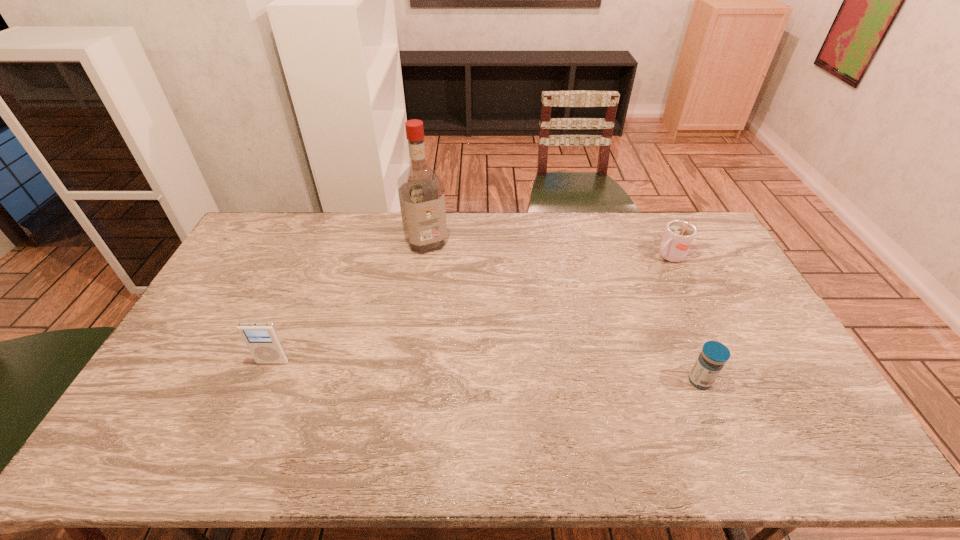
The width and height of the screenshot is (960, 540). Find the location of `the leftmost object`. the leftmost object is located at coordinates (262, 339).

I want to click on the third farthest object, so click(262, 339).

Where is `the nearest object`? The image size is (960, 540). the nearest object is located at coordinates (711, 360).

I want to click on the shortest object, so click(x=711, y=360).

Where is `cup`? The image size is (960, 540). cup is located at coordinates (678, 237).

Where is `liquor`? liquor is located at coordinates (421, 192).

Identify the location of the tallest object. (421, 192).

Locate an element on the screen. vacant space located 0.140m on the front-facing side of the iPod is located at coordinates (253, 409).

This screenshot has height=540, width=960. Find the location of `vacant region located on the left of the shortest object`. vacant region located on the left of the shortest object is located at coordinates (574, 381).

Where is `free location located on the side with the handle of the cup`? The width and height of the screenshot is (960, 540). free location located on the side with the handle of the cup is located at coordinates (620, 289).